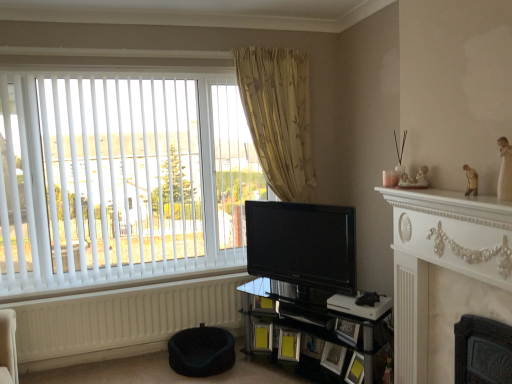
This screenshot has height=384, width=512. What are the coordinates of `empty space that is ontop of white matte radiator at lower left (from a real-world perspective)` in the screenshot? It's located at (180, 279).